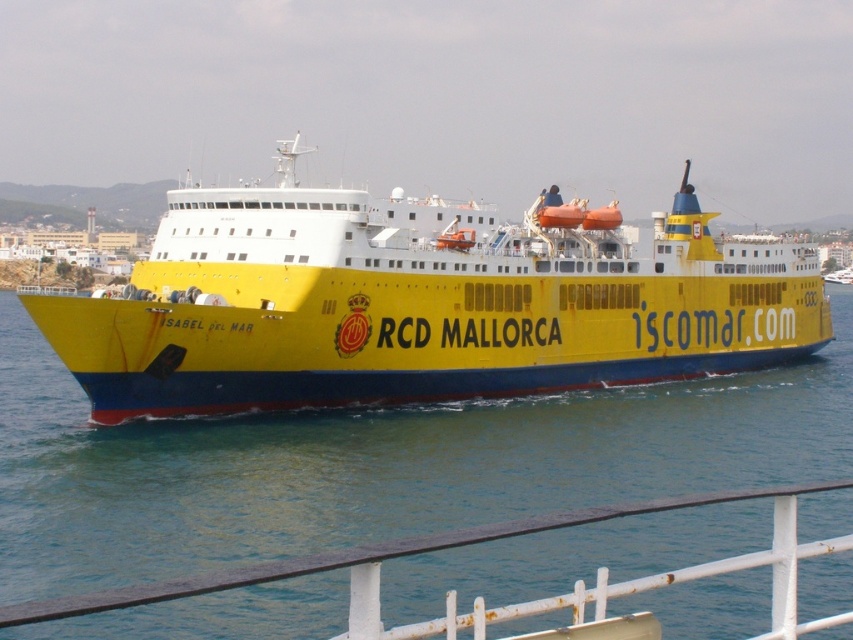
You are standing on the deck of the ferry boat Isabel del Mar and looking at the point marked at coordinate (370, 465). What do you see there?

At point (370, 465) lies blue water at center.

You are a passenger on the ferry boat Isabel del Mar. You want to take a photo of the blue water at center and the white metal railing at lower center. Which object should you focus on first if you want to capture both in a single frame without moving the camera?

The blue water at center is larger in size than the white metal railing at lower center, so you should focus on the blue water at center first to ensure it fills the frame appropriately before adjusting for the smaller railing.

You are standing on the deck of the ferry boat Isabel del Mar and notice the blue water at center and the white metal railing at lower center. Which object is positioned to the left when facing the scene?

The blue water at center is to the left of the white metal railing at lower center.